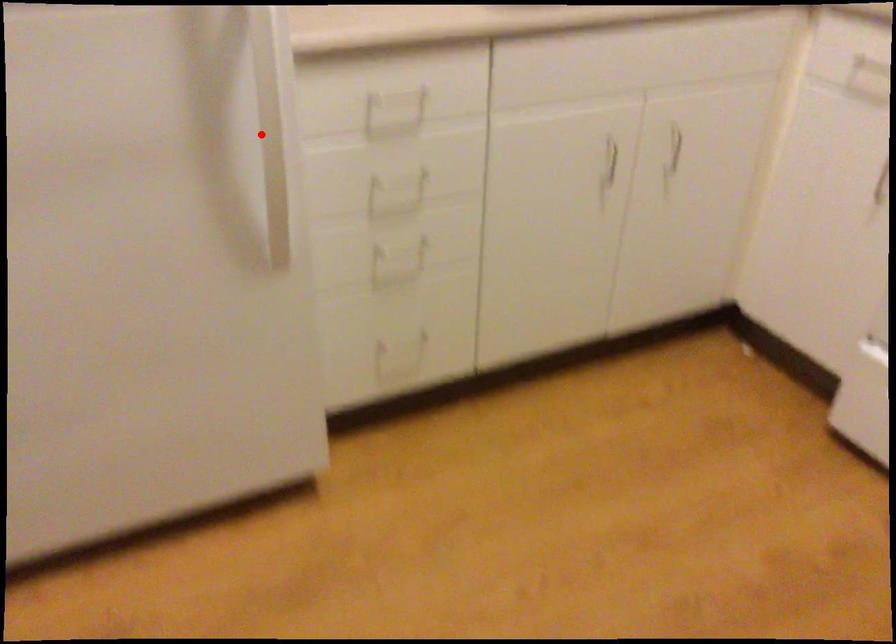
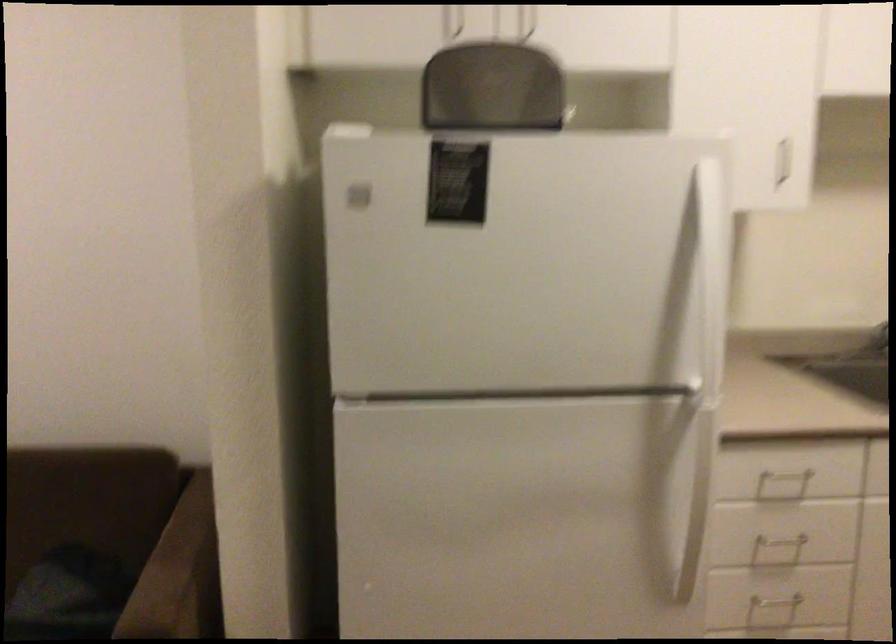
Question: I am providing you with two images of the same scene from different viewpoints. In image1, a red point is highlighted. Considering the same 3D point in image2, which of the following is correct?

Choices:
 (A) It is closer
 (B) It is farther

Answer: (B)